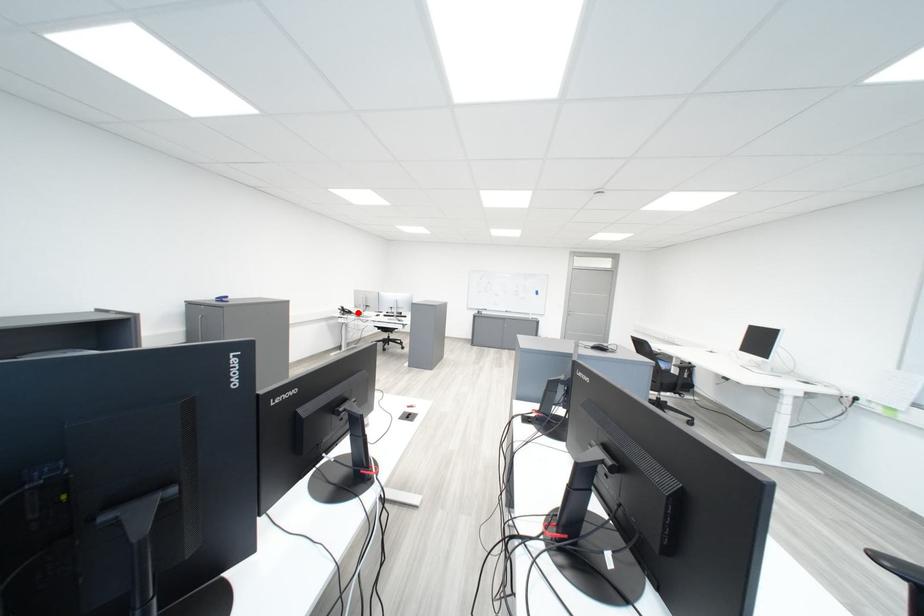
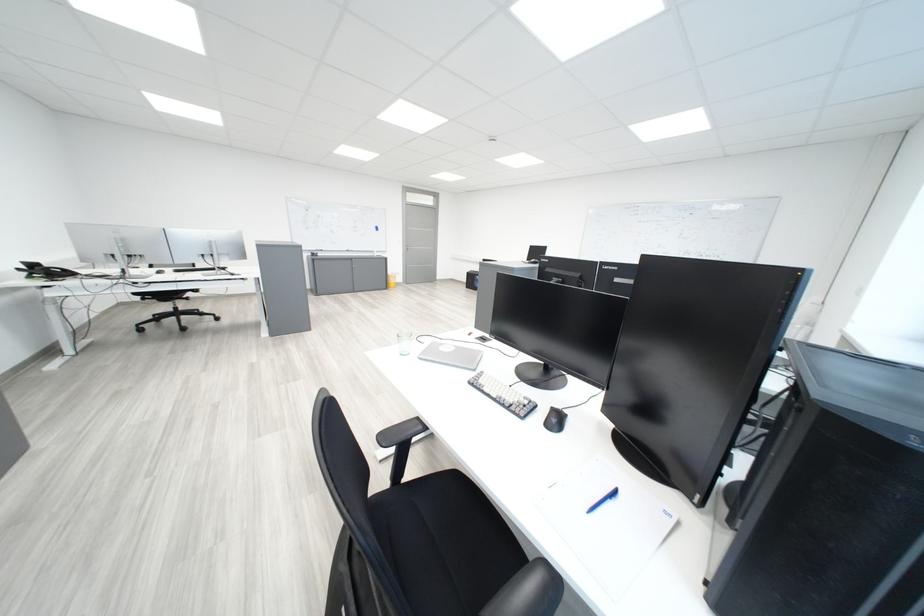
The point at the highlighted location is marked in the first image. Where is the corresponding point in the second image?

(59, 275)